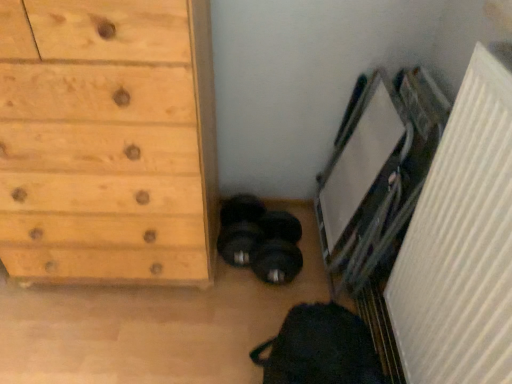
Locate an element on the screen. The image size is (512, 384). natural wood chest of drawers at left is located at coordinates (108, 141).

The height and width of the screenshot is (384, 512). Describe the element at coordinates (108, 141) in the screenshot. I see `natural wood chest of drawers at left` at that location.

Measure the distance between natural wood chest of drawers at left and camera.

natural wood chest of drawers at left is 38.33 inches from camera.

Describe the element at coordinates (462, 241) in the screenshot. Image resolution: width=512 pixels, height=384 pixels. I see `white textured radiator at right` at that location.

The image size is (512, 384). Identify the location of white textured radiator at right. [462, 241].

In order to face white textured radiator at right, should I rotate leftwards or rightwards?

Turn right approximately 27.658 degrees to face it.

Measure the distance between white textured radiator at right and camera.

white textured radiator at right is 28.98 inches from camera.

This screenshot has width=512, height=384. I want to click on natural wood chest of drawers at left, so click(x=108, y=141).

Looking at this image, does natural wood chest of drawers at left appear on the left side of white textured radiator at right?

Correct, you'll find natural wood chest of drawers at left to the left of white textured radiator at right.

Is natural wood chest of drawers at left further to camera compared to white textured radiator at right?

Yes, it is behind white textured radiator at right.

Does point (148, 57) appear closer or farther from the camera than point (423, 197)?

Point (148, 57).

From the image's perspective, between natural wood chest of drawers at left and white textured radiator at right, who is located below?

white textured radiator at right is shown below in the image.

From a real-world perspective, between natural wood chest of drawers at left and white textured radiator at right, who is vertically lower?

natural wood chest of drawers at left.

Which of these two, natural wood chest of drawers at left or white textured radiator at right, is wider?

With larger width is natural wood chest of drawers at left.

Which of these two, natural wood chest of drawers at left or white textured radiator at right, stands taller?

Standing taller between the two is natural wood chest of drawers at left.

Between natural wood chest of drawers at left and white textured radiator at right, which one has smaller size?

white textured radiator at right is smaller.

Is natural wood chest of drawers at left not inside white textured radiator at right?

Yes.

Would you say natural wood chest of drawers at left is a long distance from white textured radiator at right?

That's not correct — natural wood chest of drawers at left is a little close to white textured radiator at right.

Could you tell me if natural wood chest of drawers at left is turned towards white textured radiator at right?

No, natural wood chest of drawers at left is not oriented towards white textured radiator at right.

Can you tell me how much natural wood chest of drawers at left and white textured radiator at right differ in facing direction?

The angle between the facing direction of natural wood chest of drawers at left and the facing direction of white textured radiator at right is 90 degrees.

Find the location of `radiator lying below the natural wood chest of drawers at left (from the image's perspective)`. radiator lying below the natural wood chest of drawers at left (from the image's perspective) is located at coordinates (462, 241).

Between white textured radiator at right and natural wood chest of drawers at left, which one appears on the left side from the viewer's perspective?

Positioned to the left is natural wood chest of drawers at left.

Is white textured radiator at right positioned in front of natural wood chest of drawers at left?

Yes, the depth of white textured radiator at right is less than that of natural wood chest of drawers at left.

Considering the positions of points (492, 274) and (106, 163), is point (492, 274) closer to camera compared to point (106, 163)?

Yes, it is in front of point (106, 163).

From the image's perspective, which is below, white textured radiator at right or natural wood chest of drawers at left?

white textured radiator at right, from the image's perspective.

From a real-world perspective, is white textured radiator at right above or below natural wood chest of drawers at left?

white textured radiator at right is situated higher than natural wood chest of drawers at left in the real world.

Between white textured radiator at right and natural wood chest of drawers at left, which one has smaller width?

white textured radiator at right.

Based on the photo, between white textured radiator at right and natural wood chest of drawers at left, which one has less height?

Standing shorter between the two is white textured radiator at right.

Does white textured radiator at right have a larger size compared to natural wood chest of drawers at left?

No, white textured radiator at right is not bigger than natural wood chest of drawers at left.

Is white textured radiator at right situated inside natural wood chest of drawers at left or outside?

white textured radiator at right is not enclosed by natural wood chest of drawers at left.

Are white textured radiator at right and natural wood chest of drawers at left far apart?

No, white textured radiator at right is in close proximity to natural wood chest of drawers at left.

Is white textured radiator at right aimed at natural wood chest of drawers at left?

No, white textured radiator at right is not oriented towards natural wood chest of drawers at left.

In the image, there is a white textured radiator at right. Identify the location of the chest of drawers below it (from a real-world perspective). (108, 141).

Where is `the chest of drawers beneath the white textured radiator at right (from a real-world perspective)`? the chest of drawers beneath the white textured radiator at right (from a real-world perspective) is located at coordinates (108, 141).

I want to click on radiator located in front of the natural wood chest of drawers at left, so click(462, 241).